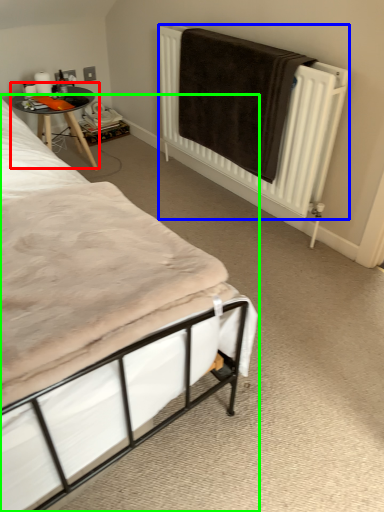
Question: Which object is positioned farthest from table (highlighted by a red box)? Select from radiator (highlighted by a blue box) and bed (highlighted by a green box).

Choices:
 (A) radiator
 (B) bed

Answer: (B)